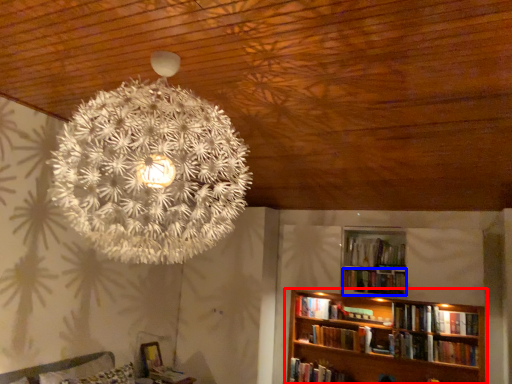
Question: Which point is further to the camera, bookcase (highlighted by a red box) or book (highlighted by a blue box)?

Choices:
 (A) bookcase
 (B) book

Answer: (B)